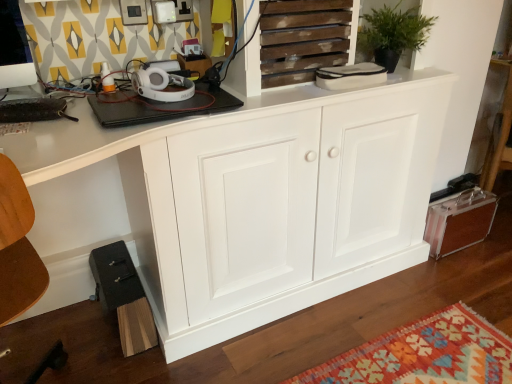
Question: Is green matte plant at upper center in front of or behind wooden slats at upper center in the image?

Choices:
 (A) behind
 (B) front

Answer: (A)

Question: Is point (379, 36) closer or farther from the camera than point (310, 66)?

Choices:
 (A) closer
 (B) farther

Answer: (B)

Question: Which object is positioned farthest from the white wood cabinet at center, the first cabinetry when ordered from left to right?

Choices:
 (A) green matte plant at upper center
 (B) metallic brown suitcase at lower right, which appears as the first cabinetry when viewed from the right
 (C) wooden slats at upper center

Answer: (B)

Question: Estimate the real-world distances between objects in this image. Which object is closer to the white wood cabinet at center, which ranks as the 2th cabinetry in right-to-left order?

Choices:
 (A) metallic brown suitcase at lower right, which is counted as the 2th cabinetry, starting from the left
 (B) green matte plant at upper center
 (C) wooden slats at upper center

Answer: (C)